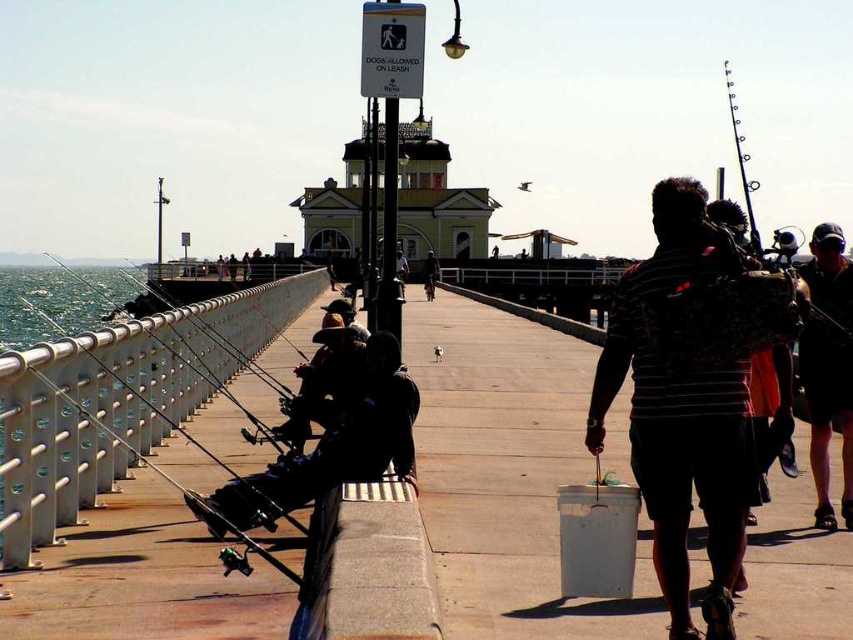
Can you confirm if clear water at railing left is wider than striped cotton shirt at center?

Yes, clear water at railing left is wider than striped cotton shirt at center.

Between clear water at railing left and striped cotton shirt at center, which one appears on the right side from the viewer's perspective?

striped cotton shirt at center

The height and width of the screenshot is (640, 853). What are the coordinates of `clear water at railing left` in the screenshot? It's located at (119, 401).

Where is `clear water at railing left`? Image resolution: width=853 pixels, height=640 pixels. clear water at railing left is located at coordinates (119, 401).

Can you confirm if black fabric cap at upper right is taller than dark blue jeans at center?

Correct, black fabric cap at upper right is much taller as dark blue jeans at center.

What do you see at coordinates (827, 413) in the screenshot? I see `black fabric cap at upper right` at bounding box center [827, 413].

This screenshot has height=640, width=853. Find the location of `black fabric cap at upper right`. black fabric cap at upper right is located at coordinates (827, 413).

Can you confirm if striped cotton shirt at center is wider than black fabric cap at upper right?

Indeed, striped cotton shirt at center has a greater width compared to black fabric cap at upper right.

How much distance is there between striped cotton shirt at center and black fabric cap at upper right?

8.69 meters

Who is more forward, (618, 294) or (840, 230)?

Positioned in front is point (618, 294).

The width and height of the screenshot is (853, 640). What are the coordinates of `striped cotton shirt at center` in the screenshot? It's located at (682, 408).